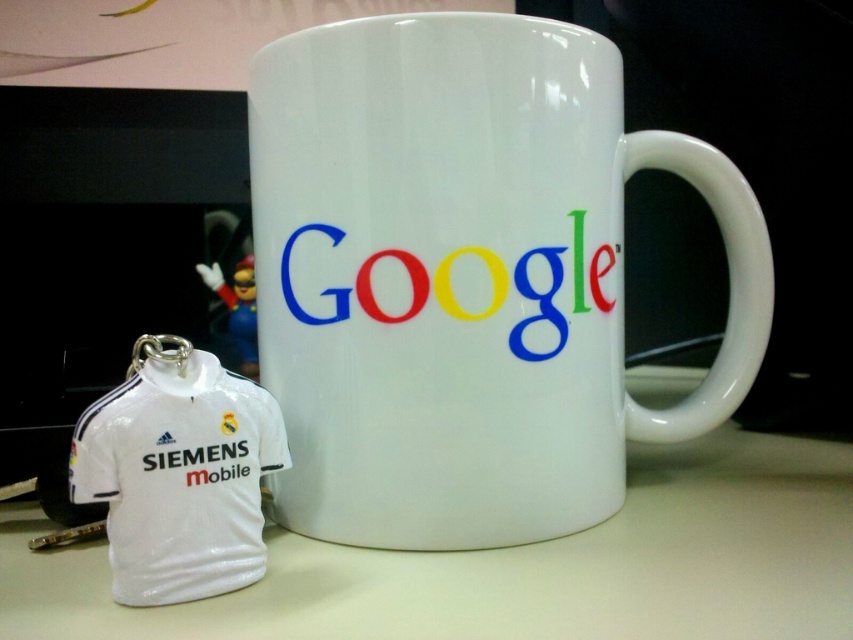
Can you confirm if white glossy mug at center is positioned to the right of white glossy jersey at lower left?

Indeed, white glossy mug at center is positioned on the right side of white glossy jersey at lower left.

Is point (376, 444) positioned in front of point (242, 436)?

No.

Where is `white glossy mug at center`? white glossy mug at center is located at coordinates (465, 276).

Between white matte table at lower center and smooth glossy google logo at center, which one is positioned lower?

Positioned lower is white matte table at lower center.

Can you confirm if white matte table at lower center is wider than smooth glossy google logo at center?

Yes, white matte table at lower center is wider than smooth glossy google logo at center.

Which is behind, point (664, 451) or point (583, 296)?

The point (664, 451) is behind.

At what (x,y) coordinates should I click in order to perform the action: click on white matte table at lower center. Please return your answer as a coordinate pair (x, y). The height and width of the screenshot is (640, 853). Looking at the image, I should click on (521, 564).

Between white glossy jersey at lower left and smooth glossy google logo at center, which one is positioned lower?

white glossy jersey at lower left

Which is more to the right, white glossy jersey at lower left or smooth glossy google logo at center?

From the viewer's perspective, smooth glossy google logo at center appears more on the right side.

This screenshot has height=640, width=853. What do you see at coordinates (178, 474) in the screenshot? I see `white glossy jersey at lower left` at bounding box center [178, 474].

At what (x,y) coordinates should I click in order to perform the action: click on white glossy jersey at lower left. Please return your answer as a coordinate pair (x, y). This screenshot has width=853, height=640. Looking at the image, I should click on (178, 474).